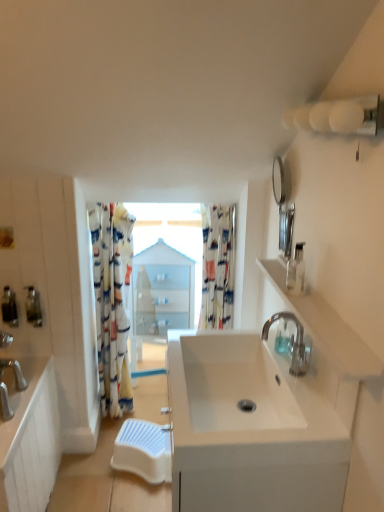
Question: From their relative heights in the image, would you say printed fabric shower curtain at left, the first shower curtain when ordered from left to right, is taller or shorter than white ceramic sink at center?

Choices:
 (A) tall
 (B) short

Answer: (A)

Question: Is printed fabric shower curtain at left, the first shower curtain when ordered from left to right, inside or outside of white ceramic sink at center?

Choices:
 (A) outside
 (B) inside

Answer: (A)

Question: Based on their relative distances, which object is farther from the matte silver soap dispenser at left, which is the 2th soap dispenser in back-to-front order?

Choices:
 (A) satin nickel cabinet at left
 (B) white ceramic sink at center
 (C) white plastic step stool at lower center
 (D) polished chrome faucet at center right
 (E) clear plastic soap dispenser at upper right, the first soap dispenser in the right-to-left sequence

Answer: (E)

Question: Which object is positioned farthest from the white glossy medicine cabinet at center?

Choices:
 (A) white plastic step stool at lower center
 (B) polished chrome faucet at center right
 (C) satin nickel cabinet at left
 (D) printed fabric shower curtain at left, the first shower curtain when ordered from left to right
 (E) white ceramic sink at center

Answer: (E)